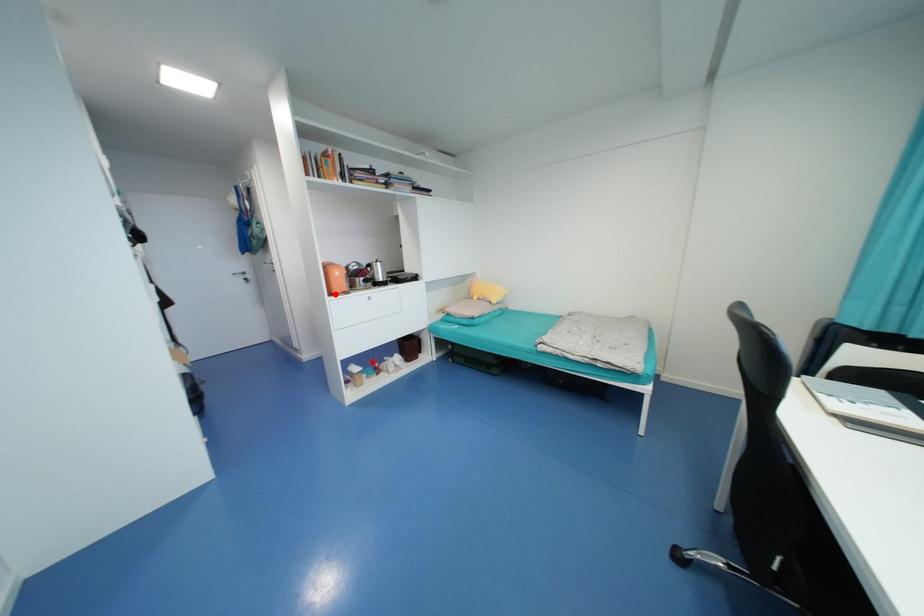
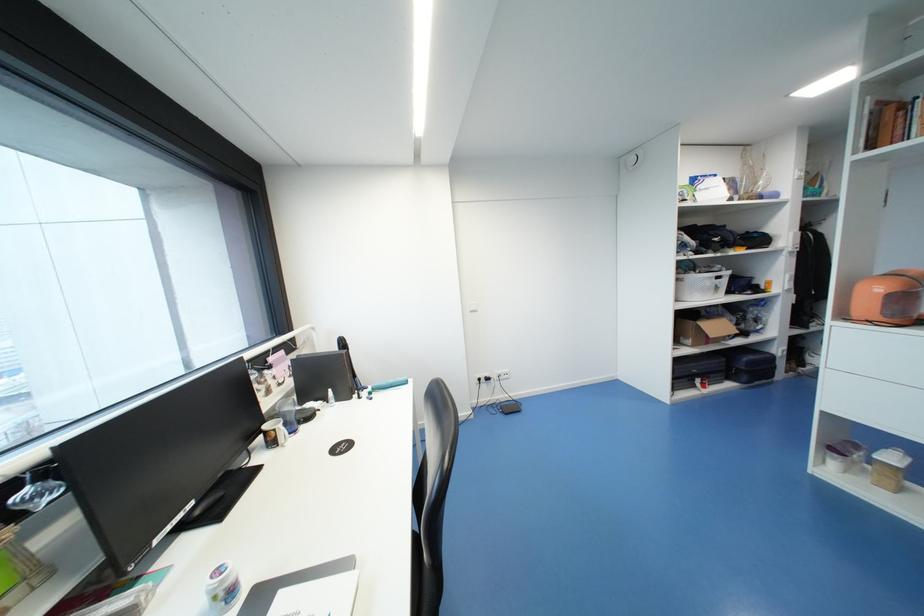
In the second image, find the point that corresponds to the highlighted location in the first image.

(849, 318)